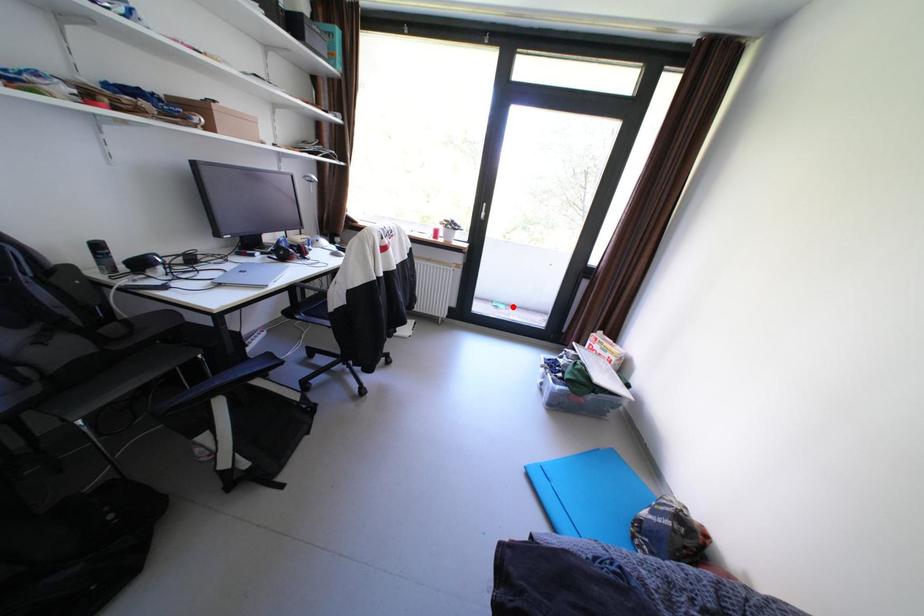
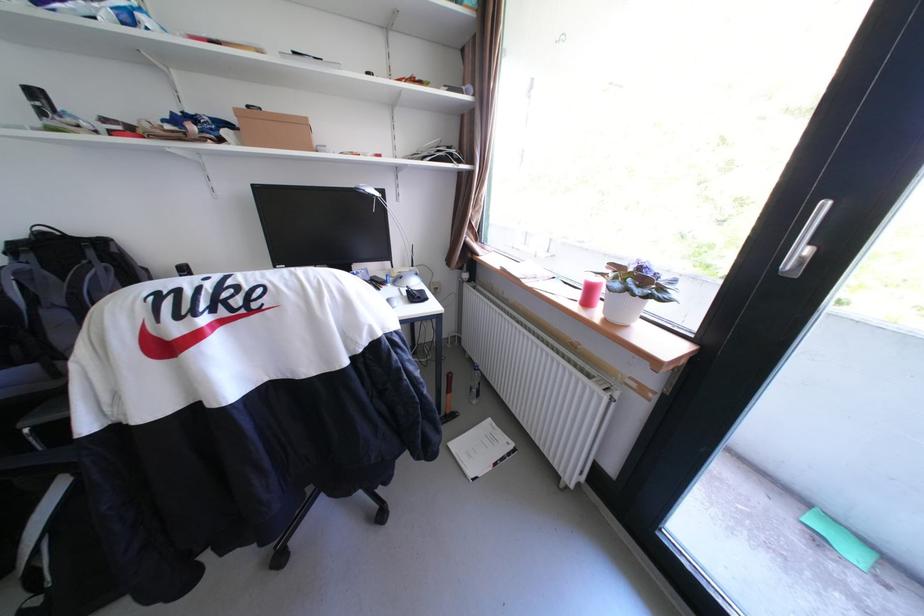
In the second image, find the point that corresponds to the highlighted location in the first image.

(867, 554)